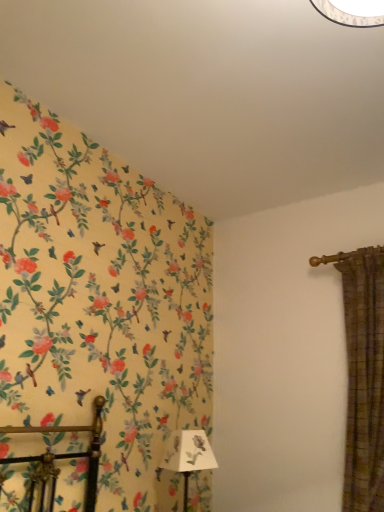
Question: Is white paper lampshade at lower center spatially inside green plaid curtain at right, or outside of it?

Choices:
 (A) outside
 (B) inside

Answer: (A)

Question: In terms of width, does white paper lampshade at lower center look wider or thinner when compared to green plaid curtain at right?

Choices:
 (A) wide
 (B) thin

Answer: (B)

Question: Considering their positions, is white paper lampshade at lower center located in front of or behind green plaid curtain at right?

Choices:
 (A) front
 (B) behind

Answer: (B)

Question: Based on their positions, is green plaid curtain at right located to the left or right of white paper lampshade at lower center?

Choices:
 (A) left
 (B) right

Answer: (B)

Question: Do you think green plaid curtain at right is within white paper lampshade at lower center, or outside of it?

Choices:
 (A) inside
 (B) outside

Answer: (B)

Question: Considering the positions of green plaid curtain at right and white paper lampshade at lower center in the image, is green plaid curtain at right wider or thinner than white paper lampshade at lower center?

Choices:
 (A) thin
 (B) wide

Answer: (B)

Question: Is point (362, 330) closer or farther from the camera than point (160, 461)?

Choices:
 (A) closer
 (B) farther

Answer: (A)